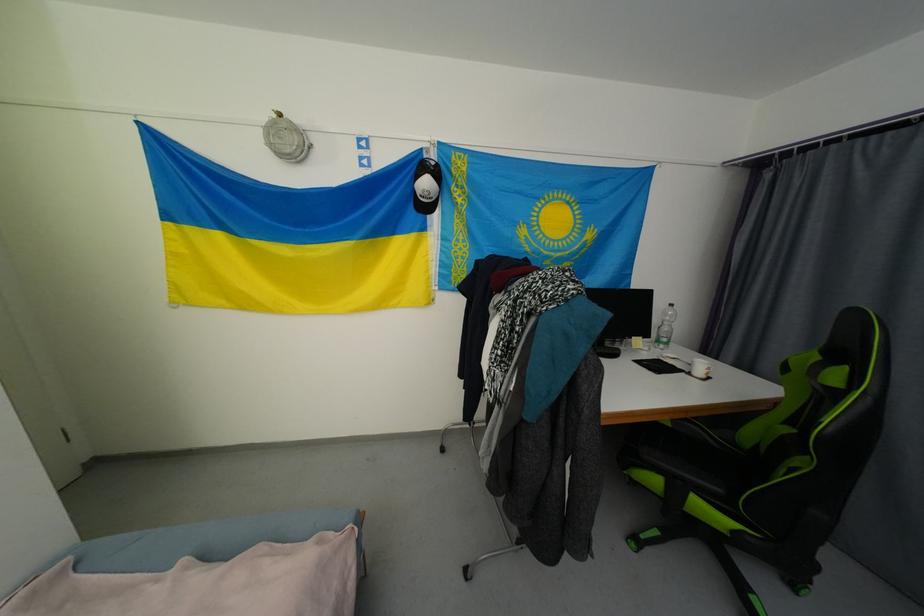
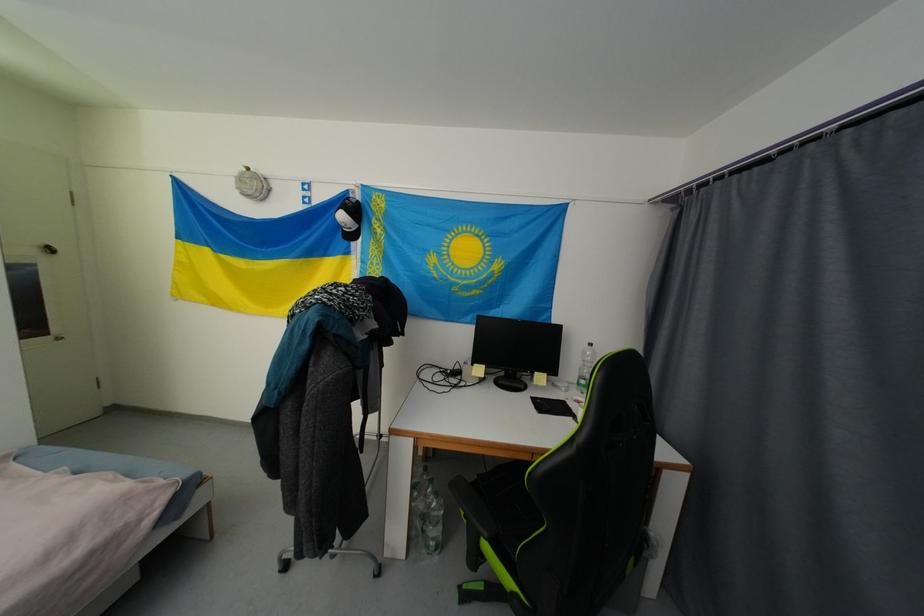
Find the pixel in the second image that matches (x=439, y=164) in the first image.

(359, 203)